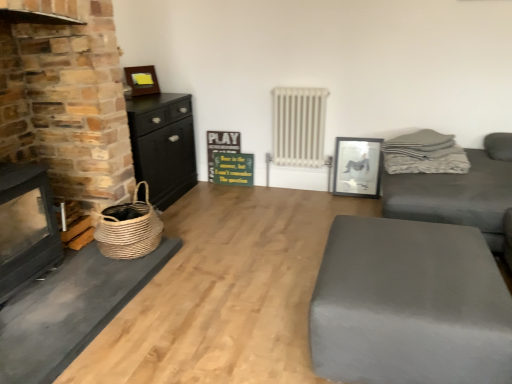
Locate an element on the screen. Image resolution: width=512 pixels, height=384 pixels. free space between brick fireplace at left and black wood chest of drawers at left is located at coordinates (187, 206).